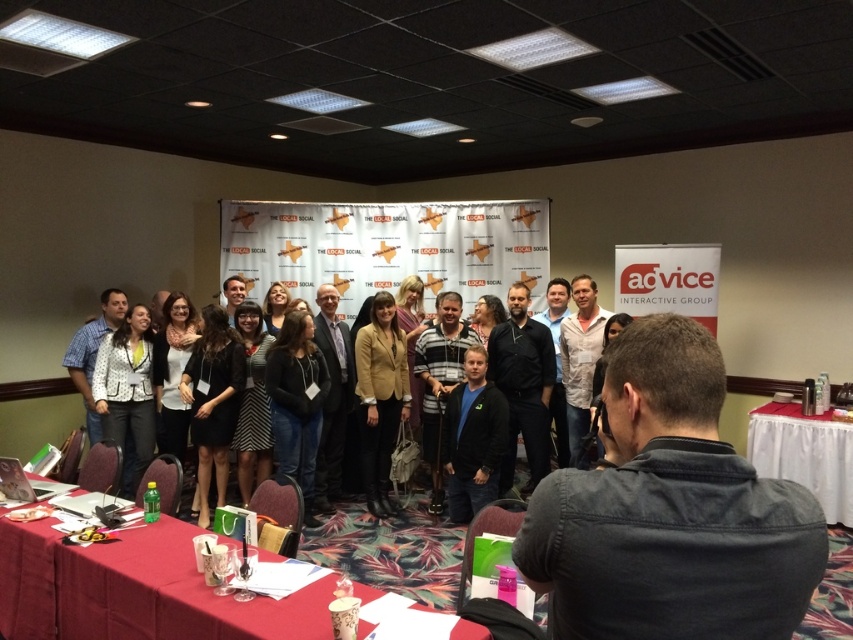
Does dark gray denim jacket at center have a lesser width compared to white cloth-covered table at lower right?

Yes.

Is point (621, 513) positioned behind point (756, 460)?

No, (621, 513) is closer to viewer.

Who is more forward, (753, 493) or (833, 476)?

Point (753, 493) is in front.

Locate an element on the screen. dark gray denim jacket at center is located at coordinates (670, 512).

Which is more to the right, smooth red tablecloth at lower left or dark blue shirt at center?

From the viewer's perspective, dark blue shirt at center appears more on the right side.

Is point (83, 572) farther from camera compared to point (521, 365)?

No, (83, 572) is closer to viewer.

This screenshot has width=853, height=640. What do you see at coordinates (135, 589) in the screenshot?
I see `smooth red tablecloth at lower left` at bounding box center [135, 589].

What are the coordinates of `smooth red tablecloth at lower left` in the screenshot? It's located at tap(135, 589).

Is smooth red tablecloth at lower left positioned in front of white cloth-covered table at lower right?

That is True.

Who is positioned more to the left, smooth red tablecloth at lower left or white cloth-covered table at lower right?

smooth red tablecloth at lower left is more to the left.

The image size is (853, 640). Find the location of `smooth red tablecloth at lower left`. smooth red tablecloth at lower left is located at coordinates (135, 589).